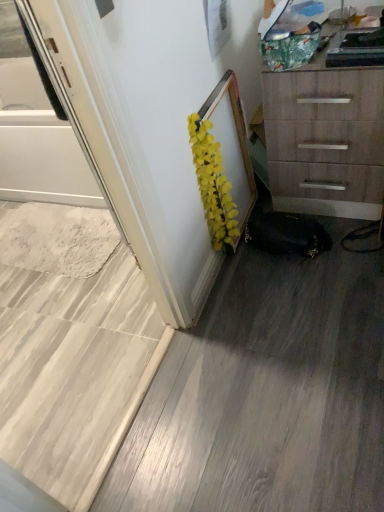
The image size is (384, 512). Find the location of `wooden chest of drawers at upper right`. wooden chest of drawers at upper right is located at coordinates (326, 140).

Image resolution: width=384 pixels, height=512 pixels. Describe the element at coordinates (36, 133) in the screenshot. I see `white glossy screen door at left` at that location.

I want to click on yellow artificial flowers at center, so click(213, 184).

Which object is further away from the camera taking this photo, wooden chest of drawers at upper right or yellow artificial flowers at center?

yellow artificial flowers at center.

How different are the orientations of wooden chest of drawers at upper right and yellow artificial flowers at center in degrees?

The angular difference between wooden chest of drawers at upper right and yellow artificial flowers at center is 90 degrees.

From a real-world perspective, which object stands above the other?

yellow artificial flowers at center.

Who is bigger, wooden chest of drawers at upper right or yellow artificial flowers at center?

With larger size is wooden chest of drawers at upper right.

From the image's perspective, is white glossy screen door at left under wooden chest of drawers at upper right?

Yes, from the image's perspective, white glossy screen door at left is below wooden chest of drawers at upper right.

What's the angular difference between white glossy screen door at left and wooden chest of drawers at upper right's facing directions?

There is a 88.6-degree angle between the facing directions of white glossy screen door at left and wooden chest of drawers at upper right.

Who is bigger, white glossy screen door at left or wooden chest of drawers at upper right?

wooden chest of drawers at upper right.

Is wooden chest of drawers at upper right completely or partially inside white glossy screen door at left?

No.

Is wooden chest of drawers at upper right completely or partially inside yellow artificial flowers at center?

No, wooden chest of drawers at upper right is located outside of yellow artificial flowers at center.

In the scene shown: From the image's perspective, between yellow artificial flowers at center and wooden chest of drawers at upper right, who is located below?

yellow artificial flowers at center appears lower in the image.

Between yellow artificial flowers at center and wooden chest of drawers at upper right, which one has larger width?

wooden chest of drawers at upper right is wider.

What's the angular difference between wooden chest of drawers at upper right and white glossy screen door at left's facing directions?

The angular difference between wooden chest of drawers at upper right and white glossy screen door at left is 88.6 degrees.

Does wooden chest of drawers at upper right have a lesser width compared to white glossy screen door at left?

Incorrect, the width of wooden chest of drawers at upper right is not less than that of white glossy screen door at left.

From a real-world perspective, is wooden chest of drawers at upper right on top of white glossy screen door at left?

No, from a real-world perspective, wooden chest of drawers at upper right is not over white glossy screen door at left

Would you consider white glossy screen door at left to be distant from yellow artificial flowers at center?

That's not correct — white glossy screen door at left is a little close to yellow artificial flowers at center.

Can you tell me how much white glossy screen door at left and yellow artificial flowers at center differ in facing direction?

The angular difference between white glossy screen door at left and yellow artificial flowers at center is 179 degrees.

Does white glossy screen door at left turn towards yellow artificial flowers at center?

No, white glossy screen door at left is not oriented towards yellow artificial flowers at center.

Does point (24, 167) appear closer or farther from the camera than point (205, 137)?

Point (24, 167) appears to be farther away from the viewer than point (205, 137).

Between point (229, 241) and point (32, 131), which one is positioned behind?

The point (32, 131) is behind.

Can you confirm if yellow artificial flowers at center is wider than white glossy screen door at left?

No.

From the image's perspective, is yellow artificial flowers at center located above or below white glossy screen door at left?

Clearly, from the image's perspective, yellow artificial flowers at center is below white glossy screen door at left.

The height and width of the screenshot is (512, 384). Identify the location of flower to the left of wooden chest of drawers at upper right. point(213,184).

In order to click on screen door that appears in front of the wooden chest of drawers at upper right in this screenshot , I will do `click(36, 133)`.

Considering their positions, is wooden chest of drawers at upper right positioned closer to yellow artificial flowers at center than white glossy screen door at left?

The object closer to yellow artificial flowers at center is wooden chest of drawers at upper right.

Estimate the real-world distances between objects in this image. Which object is further from white glossy screen door at left, yellow artificial flowers at center or wooden chest of drawers at upper right?

Among the two, wooden chest of drawers at upper right is located further to white glossy screen door at left.

Based on their spatial positions, is white glossy screen door at left or wooden chest of drawers at upper right further from yellow artificial flowers at center?

Based on the image, white glossy screen door at left appears to be further to yellow artificial flowers at center.

From the image, which object appears to be farther from wooden chest of drawers at upper right, white glossy screen door at left or yellow artificial flowers at center?

Among the two, white glossy screen door at left is located further to wooden chest of drawers at upper right.

From the image, which object appears to be farther from white glossy screen door at left, wooden chest of drawers at upper right or yellow artificial flowers at center?

wooden chest of drawers at upper right lies further to white glossy screen door at left than the other object.

From the image, which object appears to be farther from wooden chest of drawers at upper right, yellow artificial flowers at center or white glossy screen door at left?

white glossy screen door at left lies further to wooden chest of drawers at upper right than the other object.

The height and width of the screenshot is (512, 384). In order to click on flower between white glossy screen door at left and wooden chest of drawers at upper right in this screenshot , I will do `click(213, 184)`.